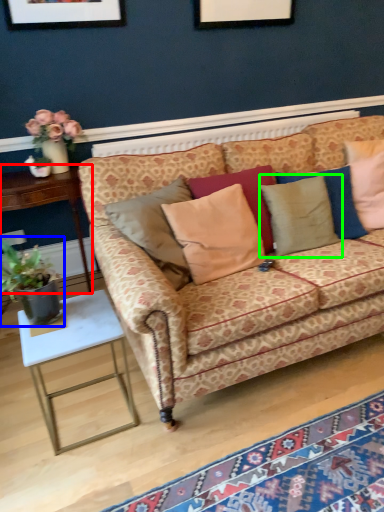
Question: Estimate the real-world distances between objects in this image. Which object is closer to table (highlighted by a red box), houseplant (highlighted by a blue box) or pillow (highlighted by a green box)?

Choices:
 (A) houseplant
 (B) pillow

Answer: (A)